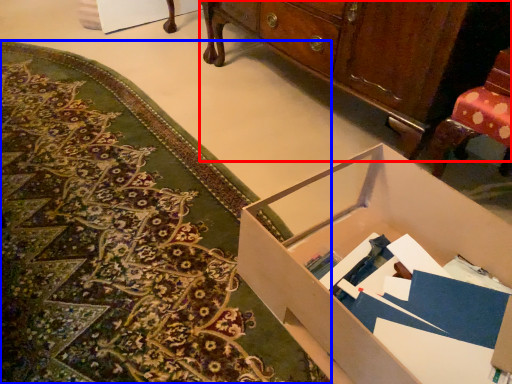
Question: Which point is closer to the camera, cabinetry (highlighted by a red box) or mat (highlighted by a blue box)?

Choices:
 (A) cabinetry
 (B) mat

Answer: (B)